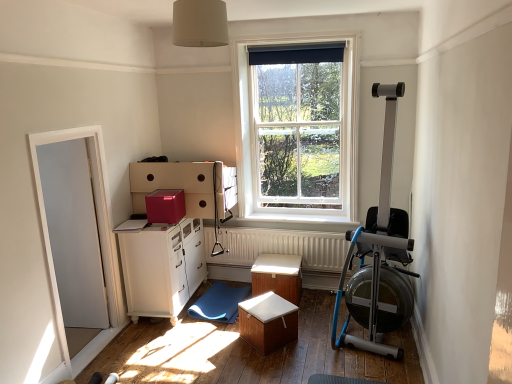
At what (x,y) coordinates should I click in order to perform the action: click on silver metallic rowing machine at right. Please return your answer as a coordinate pair (x, y). This screenshot has height=384, width=512. Looking at the image, I should click on tap(379, 256).

Where is `matte pink cardboard box at upper center`? The height and width of the screenshot is (384, 512). matte pink cardboard box at upper center is located at coordinates coord(165,206).

You are a GUI agent. You are given a task and a screenshot of the screen. Output one action in this format:
    pyautogui.click(x=<x>, y=<y>)
    Task: Click on the white textured radiator at center
    Image resolution: width=512 pixels, height=384 pixels.
    Given the screenshot: What is the action you would take?
    pyautogui.click(x=280, y=247)

Where is `beige fabric lampshade at upper center`? The width and height of the screenshot is (512, 384). beige fabric lampshade at upper center is located at coordinates (200, 23).

The width and height of the screenshot is (512, 384). Identify the location of silver metallic rowing machine at right. (379, 256).

Is point (234, 288) positioned after point (277, 330)?

Yes, it is.

You are a GUI agent. You are given a task and a screenshot of the screen. Output one action in this format:
    pyautogui.click(x=<x>, y=<y>)
    Task: Click on the 1st table to the right when counting from the blue rubber mat at lower center
    
    Given the screenshot: What is the action you would take?
    pyautogui.click(x=268, y=322)

Is blue rubber mat at lower center taller than wooden table at center, which appears as the 2th table when viewed from the back?

No.

From the picture: From the image's perspective, is blue rubber mat at lower center positioned above or below wooden table at center, which appears as the 2th table when viewed from the back?

Clearly, from the image's perspective, blue rubber mat at lower center is above wooden table at center, which appears as the 2th table when viewed from the back.

Considering their positions, is white glossy door at left located in front of or behind matte pink cardboard box at upper center?

Visually, white glossy door at left is located in front of matte pink cardboard box at upper center.

Looking at this image, is white glossy door at left not within matte pink cardboard box at upper center?

Yes.

From the image's perspective, is white glossy door at left over matte pink cardboard box at upper center?

Actually, white glossy door at left appears below matte pink cardboard box at upper center in the image.

Which of these two, white glossy door at left or matte pink cardboard box at upper center, is smaller?

matte pink cardboard box at upper center.

Which is in front, point (249, 312) or point (222, 299)?

The point (249, 312) is closer to the camera.

How distant is wooden table at center, which appears as the 2th table when viewed from the back, from blue rubber mat at lower center?

The distance of wooden table at center, which appears as the 2th table when viewed from the back, from blue rubber mat at lower center is 21.82 inches.

Are wooden table at center, the first table positioned from the front, and blue rubber mat at lower center far apart?

wooden table at center, the first table positioned from the front, is near blue rubber mat at lower center, not far away.

From the image's perspective, relative to blue rubber mat at lower center, is wooden table at center, the first table positioned from the front, above or below?

wooden table at center, the first table positioned from the front, is below blue rubber mat at lower center.

Do you think silver metallic rowing machine at right is within white wooden window at center, or outside of it?

silver metallic rowing machine at right is not enclosed by white wooden window at center.

Is silver metallic rowing machine at right thinner than white wooden window at center?

No, silver metallic rowing machine at right is not thinner than white wooden window at center.

Between silver metallic rowing machine at right and white wooden window at center, which one appears on the left side from the viewer's perspective?

From the viewer's perspective, white wooden window at center appears more on the left side.

How many degrees apart are the facing directions of silver metallic rowing machine at right and white wooden window at center?

The angular difference between silver metallic rowing machine at right and white wooden window at center is 4.74 degrees.

Is white textured radiator at center in front of white glossy cabinet at lower left?

No, it is behind white glossy cabinet at lower left.

From the picture: From a real-world perspective, is white textured radiator at center on white glossy cabinet at lower left?

No.

Is white textured radiator at center turned away from white glossy cabinet at lower left?

That's not correct — white textured radiator at center is not looking away from white glossy cabinet at lower left.

Considering the relative sizes of white textured radiator at center and white glossy cabinet at lower left in the image provided, is white textured radiator at center smaller than white glossy cabinet at lower left?

Indeed, white textured radiator at center has a smaller size compared to white glossy cabinet at lower left.

Consider the image. Which object is wider, white wooden window at center or beige fabric lampshade at upper center?

Wider between the two is beige fabric lampshade at upper center.

Based on their positions, is white wooden window at center located to the left or right of beige fabric lampshade at upper center?

white wooden window at center is to the right of beige fabric lampshade at upper center.

Is point (301, 205) more distant than point (191, 38)?

Yes, it is behind point (191, 38).

From their relative heights in the image, would you say white wooden window at center is taller or shorter than beige fabric lampshade at upper center?

Considering their sizes, white wooden window at center has more height than beige fabric lampshade at upper center.

This screenshot has height=384, width=512. I want to click on window above the white glossy cabinet at lower left (from the image's perspective), so click(x=297, y=136).

Consider the image. From the image's perspective, is white wooden window at center above or below white glossy cabinet at lower left?

From the image's perspective, white wooden window at center appears above white glossy cabinet at lower left.

Is white wooden window at center bigger than white glossy cabinet at lower left?

Actually, white wooden window at center might be smaller than white glossy cabinet at lower left.

Does white wooden window at center appear on the right side of white glossy cabinet at lower left?

Yes, white wooden window at center is to the right of white glossy cabinet at lower left.

Identify the location of swivel chair located above the wooden table at center, the first table positioned from the front (from the image's perspective). This screenshot has height=384, width=512. (219, 303).

Locate an element on the screen. This screenshot has width=512, height=384. door that is below the matte pink cardboard box at upper center (from the image's perspective) is located at coordinates (74, 233).

Which object lies nearer to the anchor point white textured radiator at center, white glossy cabinet at lower left or blue rubber mat at lower center?

blue rubber mat at lower center lies closer to white textured radiator at center than the other object.

Estimate the real-world distances between objects in this image. Which object is further from white textured radiator at center, white wooden window at center or beige fabric lampshade at upper center?

beige fabric lampshade at upper center.

Looking at the image, which one is located further to white glossy cabinet at lower left, matte pink cardboard box at upper center or white textured radiator at center?

white textured radiator at center.

From the image, which object appears to be farther from matte pink cardboard box at upper center, white textured radiator at center or black fabric curtain at upper center?

The object further to matte pink cardboard box at upper center is black fabric curtain at upper center.

Which object lies nearer to the anchor point blue rubber mat at lower center, white glossy cabinet at lower left or black fabric curtain at upper center?

The object closer to blue rubber mat at lower center is white glossy cabinet at lower left.

Looking at the image, which one is located closer to matte pink cardboard box at upper center, wooden table at center, the first table positioned from the front, or wooden table at center, which is the 2th table from front to back?

wooden table at center, which is the 2th table from front to back, is positioned closer to the anchor matte pink cardboard box at upper center.

Which object lies further to the anchor point white textured radiator at center, white wooden window at center or wooden table at center, which appears as the 2th table when viewed from the back?

Among the two, wooden table at center, which appears as the 2th table when viewed from the back, is located further to white textured radiator at center.

Based on their spatial positions, is blue rubber mat at lower center or wooden table at center, which appears as the 2th table when viewed from the back, closer to white wooden window at center?

blue rubber mat at lower center.

You are a GUI agent. You are given a task and a screenshot of the screen. Output one action in this format:
    pyautogui.click(x=<x>, y=<y>)
    Task: Click on the cardboard box positioned between beige fabric lampshade at upper center and blue rubber mat at lower center from near to far
    The image size is (512, 384).
    Given the screenshot: What is the action you would take?
    pyautogui.click(x=165, y=206)

At what (x,y) coordinates should I click in order to perform the action: click on swivel chair located between matte pink cardboard box at upper center and silver metallic rowing machine at right in the left-right direction. Please return your answer as a coordinate pair (x, y). This screenshot has height=384, width=512. Looking at the image, I should click on (219, 303).

Where is `window between silver metallic rowing machine at right and white textured radiator at center in the front-back direction`? This screenshot has height=384, width=512. window between silver metallic rowing machine at right and white textured radiator at center in the front-back direction is located at coordinates (297, 136).

At what (x,y) coordinates should I click in order to perform the action: click on table between matte pink cardboard box at upper center and wooden table at center, which is the 2th table from front to back. Please return your answer as a coordinate pair (x, y). Image resolution: width=512 pixels, height=384 pixels. Looking at the image, I should click on (268, 322).